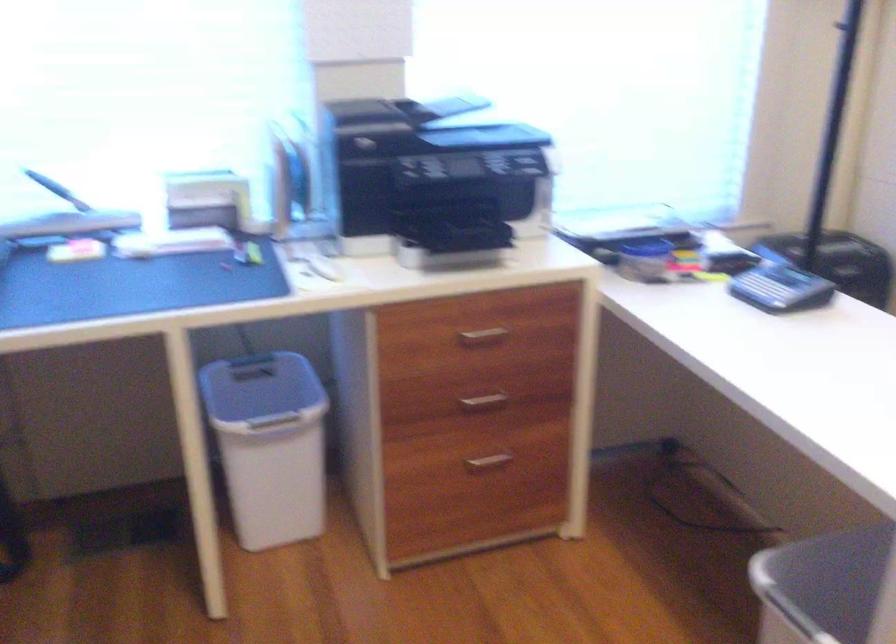
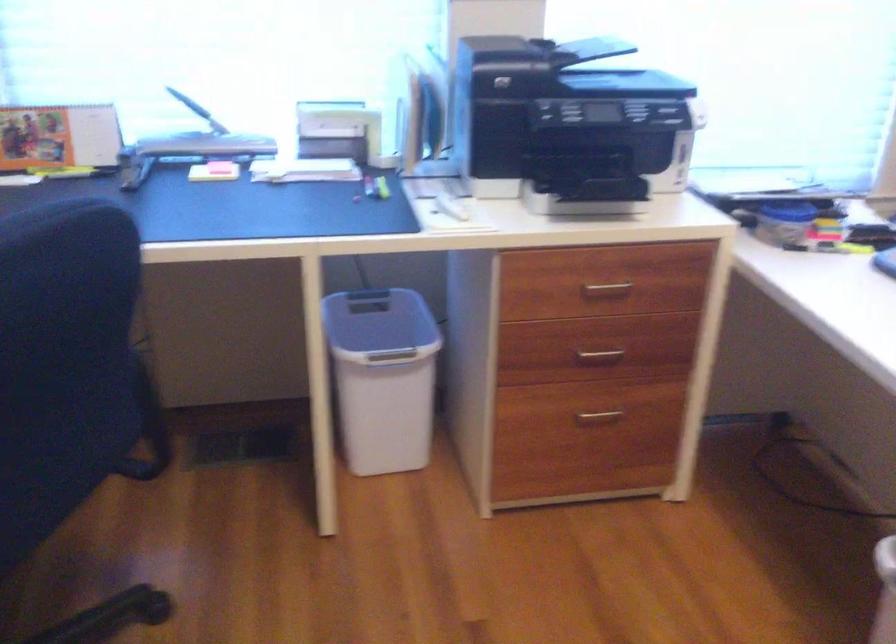
Question: The camera is either moving clockwise (left) or counter-clockwise (right) around the object. The first image is from the beginning of the video and the second image is from the end. Is the camera moving left or right when shooting the video?

Choices:
 (A) Left
 (B) Right

Answer: (B)